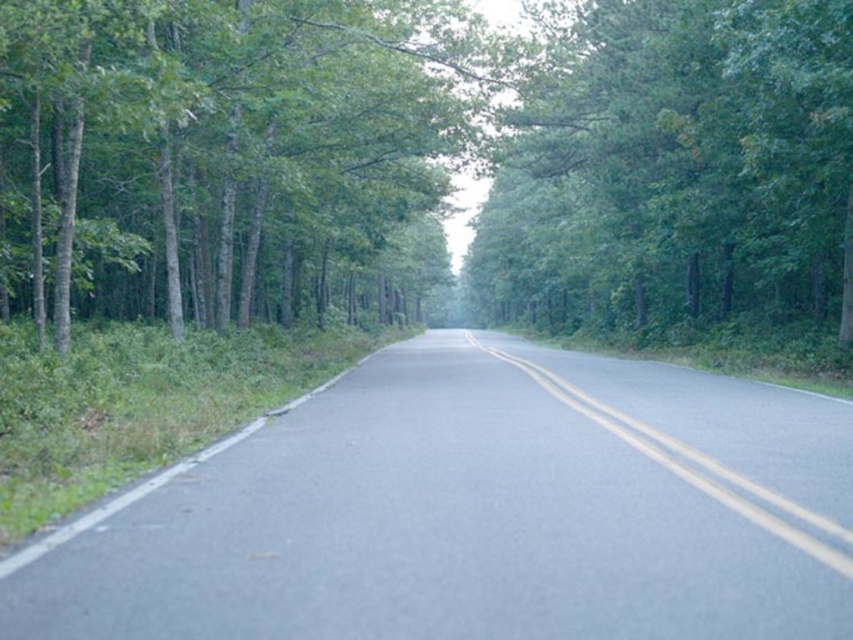
Question: Among these objects, which one is farthest from the camera?

Choices:
 (A) yellow asphalt road at center
 (B) green leafy tree at upper center
 (C) green leafy tree at center

Answer: (B)

Question: Which of the following is the farthest from the observer?

Choices:
 (A) green leafy tree at center
 (B) yellow asphalt road at center

Answer: (A)

Question: Which point is closer to the camera?

Choices:
 (A) yellow asphalt road at center
 (B) green leafy tree at center

Answer: (A)

Question: Is green leafy tree at center thinner than green leafy tree at upper center?

Choices:
 (A) yes
 (B) no

Answer: (B)

Question: Observing the image, what is the correct spatial positioning of green leafy tree at upper center in reference to yellow asphalt road at center?

Choices:
 (A) below
 (B) above

Answer: (B)

Question: Does green leafy tree at center have a smaller size compared to green leafy tree at upper center?

Choices:
 (A) no
 (B) yes

Answer: (A)